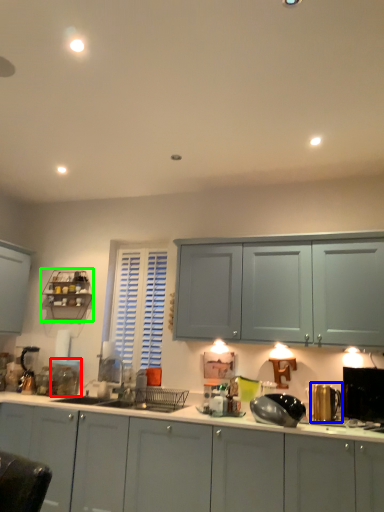
Question: Which object is positioned farthest from appliance (highlighted by a red box)? Select from appliance (highlighted by a blue box) and shelf (highlighted by a green box).

Choices:
 (A) appliance
 (B) shelf

Answer: (A)